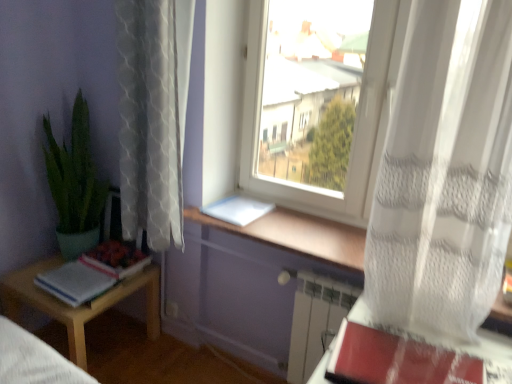
The width and height of the screenshot is (512, 384). I want to click on vacant space in front of white paper at window, the 1th paperback book viewed from the top, so click(x=265, y=235).